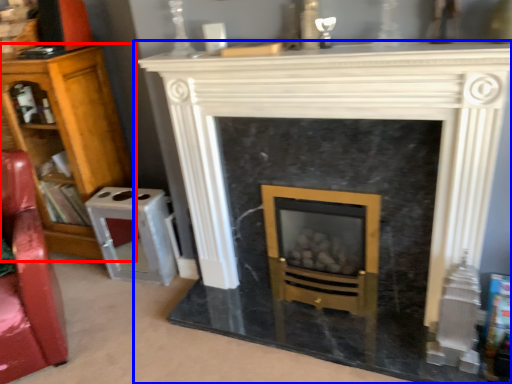
Question: Among these objects, which one is farthest to the camera, bookcase (highlighted by a red box) or fireplace (highlighted by a blue box)?

Choices:
 (A) bookcase
 (B) fireplace

Answer: (A)